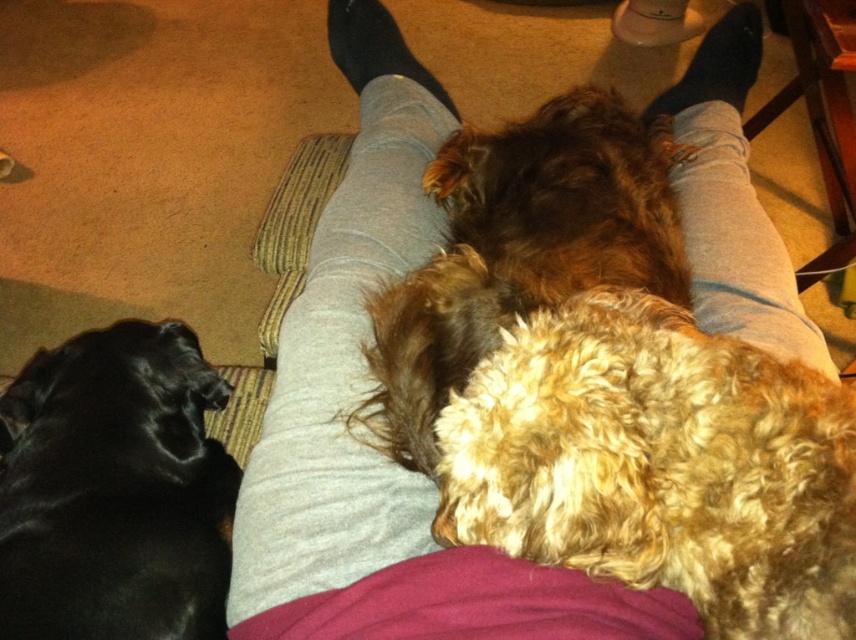
You are a photographer trying to capture a closeup of the two points in the image. Which point, point (480, 300) or point (76, 412), is closer to your camera?

Point (480, 300) is closer to the camera than point (76, 412).

You are a photographer standing at a distance of 21.48 inches from the curly brown fur at center. You want to take a picture of the person and both dogs without moving the camera. Can you include the entire scene in the frame?

Yes, because the distance between you and the curly brown fur at center is exactly 21.48 inches, which is within the camera lens range to capture the entire scene.

From the picture: You are a dog groomer assessing the two dogs in the image. The curly brown fur at center and the black fur at lower left need their fur trimmed. Which dog requires more fur to be trimmed based on their size?

The curly brown fur at center requires more fur to be trimmed because it has a larger size compared to the black fur at lower left.